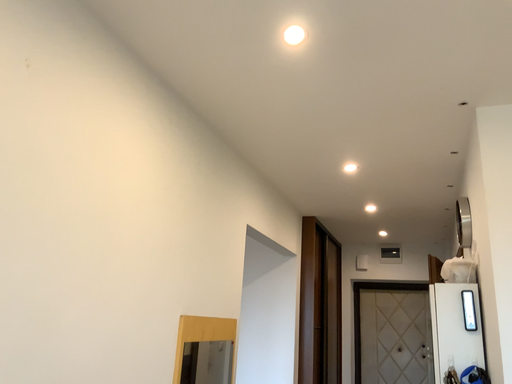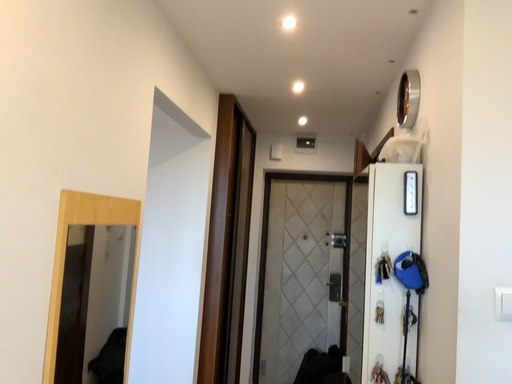
Question: Which way did the camera rotate in the video?

Choices:
 (A) rotated left
 (B) rotated right

Answer: (B)